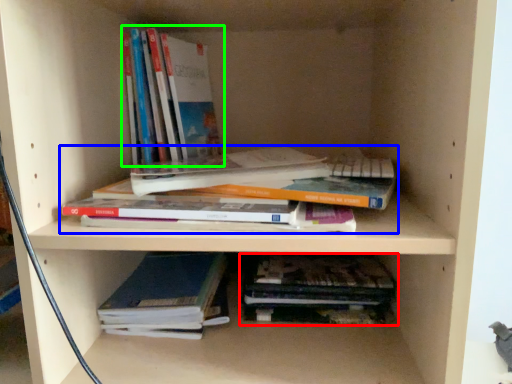
Question: Estimate the real-world distances between objects in this image. Which object is closer to book (highlighted by a red box), book (highlighted by a blue box) or book (highlighted by a green box)?

Choices:
 (A) book
 (B) book

Answer: (A)